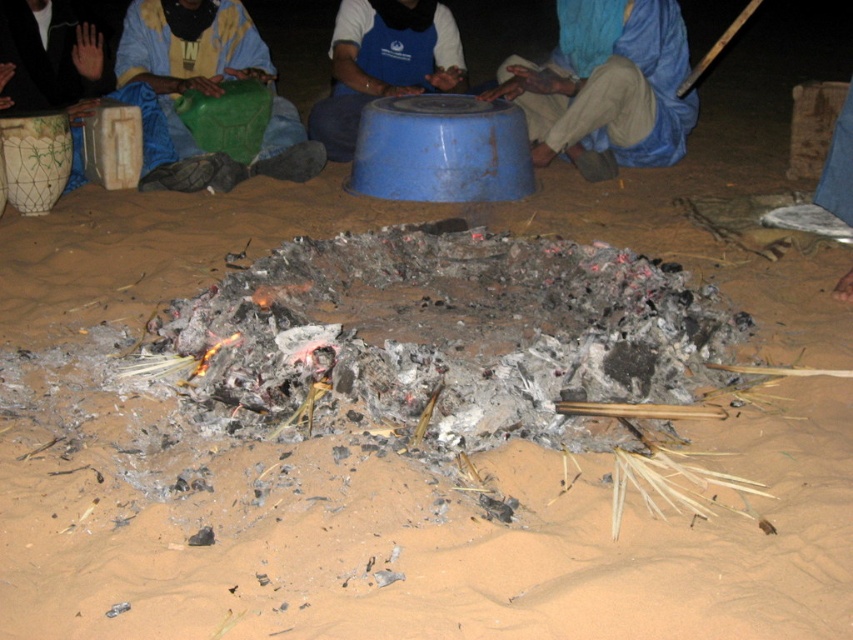
Question: Which object is the farthest from the blue plastic bowl at center?

Choices:
 (A) blue fabric headscarf at upper center
 (B) green plastic container at left

Answer: (A)

Question: Which object appears farthest from the camera in this image?

Choices:
 (A) blue fabric headscarf at upper center
 (B) green plastic container at left
 (C) blue plastic bowl at center

Answer: (C)

Question: Which object appears farthest from the camera in this image?

Choices:
 (A) green plastic container at left
 (B) blue fabric headscarf at upper center

Answer: (B)

Question: Can you confirm if blue fabric headscarf at upper center is thinner than blue plastic bowl at center?

Choices:
 (A) no
 (B) yes

Answer: (A)

Question: Is blue fabric headscarf at upper center positioned in front of blue plastic bowl at center?

Choices:
 (A) no
 (B) yes

Answer: (B)

Question: Does green plastic container at left appear on the right side of blue plastic bowl at center?

Choices:
 (A) no
 (B) yes

Answer: (A)